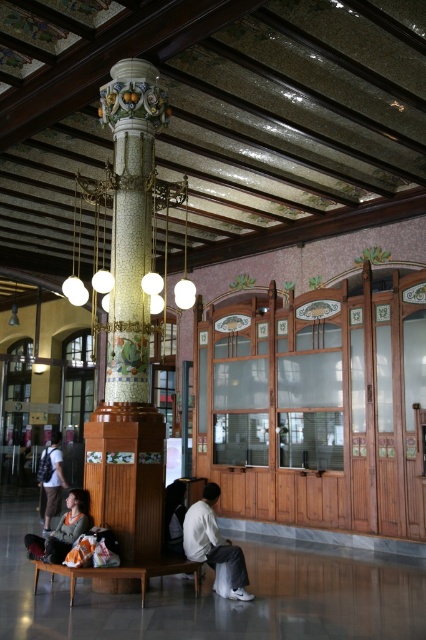
Is matte glass chandelier at center above matte gray sweater at lower left?

Indeed, matte glass chandelier at center is positioned over matte gray sweater at lower left.

Can you confirm if matte glass chandelier at center is bigger than matte gray sweater at lower left?

Incorrect, matte glass chandelier at center is not larger than matte gray sweater at lower left.

This screenshot has width=426, height=640. I want to click on matte glass chandelier at center, so click(x=117, y=232).

Between matte gray sweater at lower left and matte black backpack at lower left, which one is positioned lower?

matte black backpack at lower left is below.

Does matte gray sweater at lower left appear under matte black backpack at lower left?

Actually, matte gray sweater at lower left is above matte black backpack at lower left.

Image resolution: width=426 pixels, height=640 pixels. What do you see at coordinates (62, 531) in the screenshot? I see `matte gray sweater at lower left` at bounding box center [62, 531].

Find the location of a particular element. Image resolution: width=426 pixels, height=640 pixels. matte gray sweater at lower left is located at coordinates [x=62, y=531].

Which is below, matte glass chandelier at center or white matte shirt at center?

white matte shirt at center

This screenshot has height=640, width=426. Identify the location of matte glass chandelier at center. (117, 232).